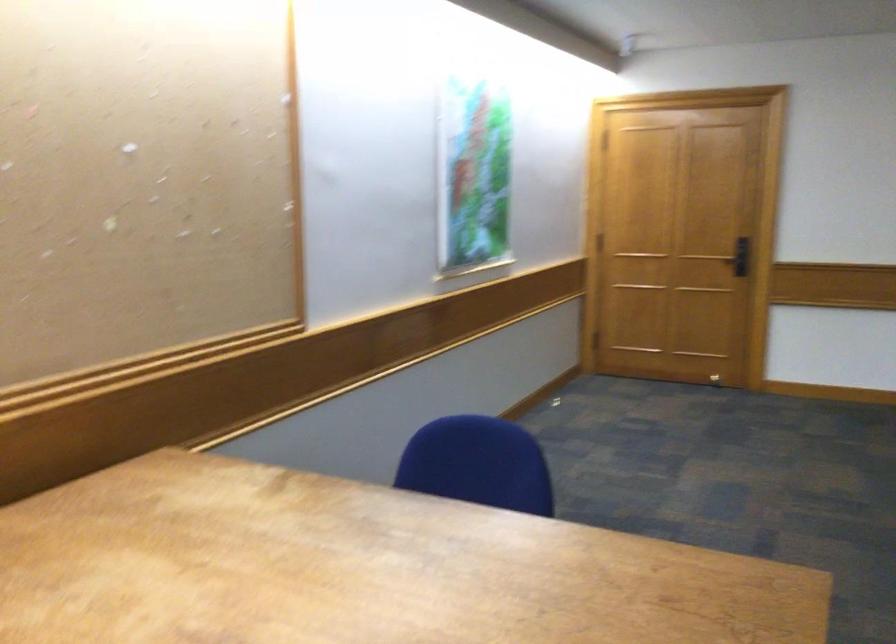
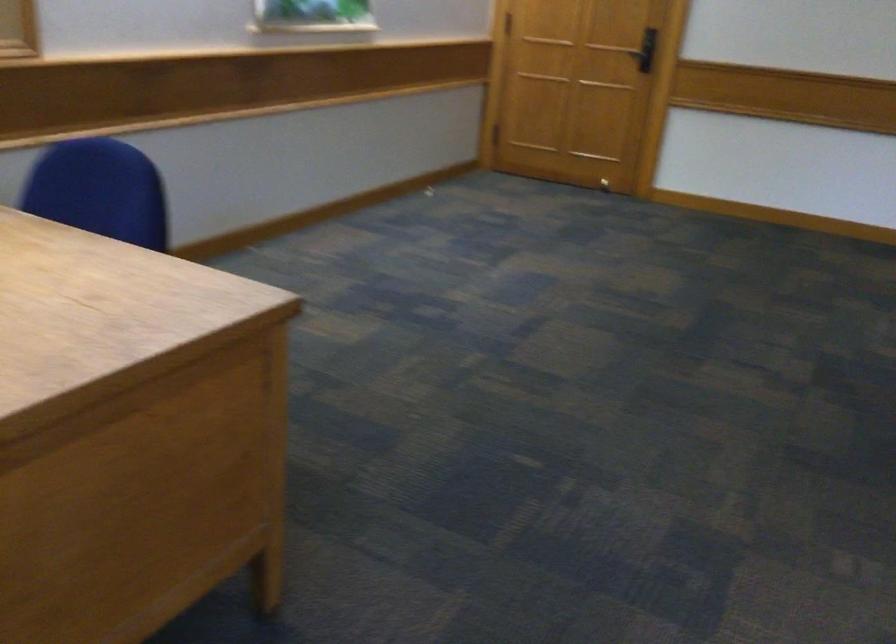
Question: In a continuous first-person perspective shot, in which direction is the camera moving?

Choices:
 (A) Left
 (B) Right
 (C) Forward
 (D) Backward

Answer: (B)